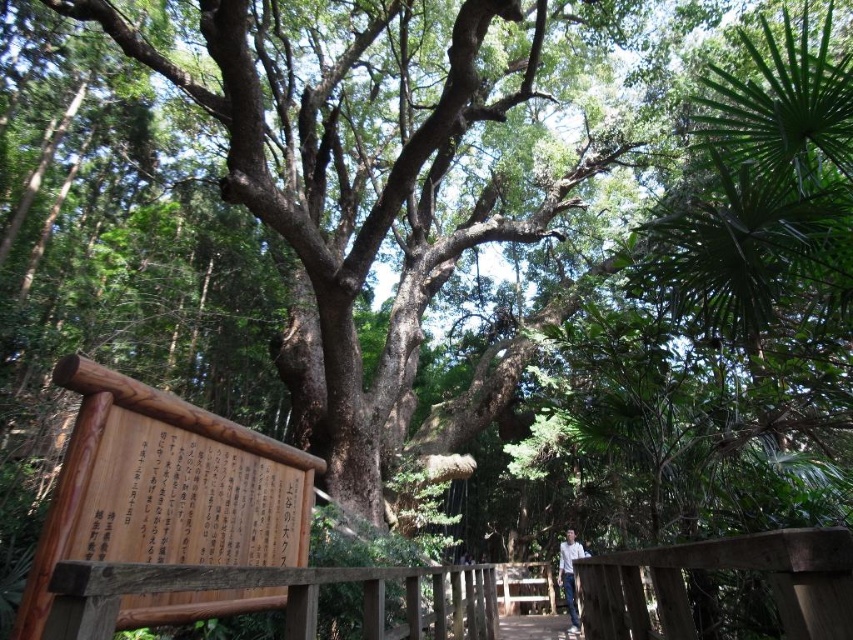
Between brown wooden rail at lower center and white shirt at center, which one is positioned lower?

Positioned lower is white shirt at center.

Which is behind, point (102, 579) or point (570, 557)?

The point (570, 557) is more distant.

You are a GUI agent. You are given a task and a screenshot of the screen. Output one action in this format:
    pyautogui.click(x=<x>, y=<y>)
    Task: Click on the brown wooden rail at lower center
    This screenshot has height=640, width=853.
    Given the screenshot: What is the action you would take?
    pyautogui.click(x=271, y=584)

Is point (433, 589) farther from viewer compared to point (506, 620)?

No.

I want to click on brown wooden rail at lower center, so click(x=271, y=584).

This screenshot has width=853, height=640. I want to click on brown wooden rail at lower center, so click(271, 584).

Is point (531, 628) closer to camera compared to point (566, 582)?

Yes, it is in front of point (566, 582).

Is the position of wooden bridge at center more distant than that of white shirt at center?

No, it is in front of white shirt at center.

Describe the element at coordinates (535, 627) in the screenshot. I see `wooden bridge at center` at that location.

You are a GUI agent. You are given a task and a screenshot of the screen. Output one action in this format:
    pyautogui.click(x=<x>, y=<y>)
    Task: Click on the wooden bridge at center
    
    Given the screenshot: What is the action you would take?
    pyautogui.click(x=535, y=627)